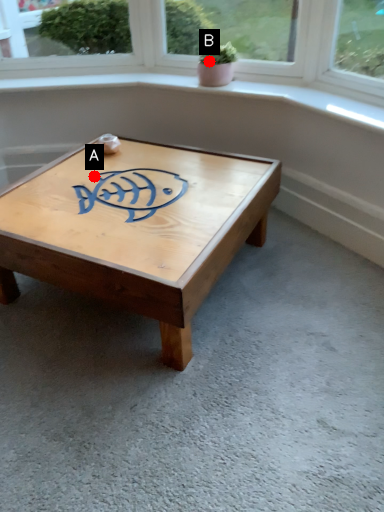
Question: Two points are circled on the image, labeled by A and B beside each circle. Which point appears closest to the camera in this image?

Choices:
 (A) A is closer
 (B) B is closer

Answer: (A)